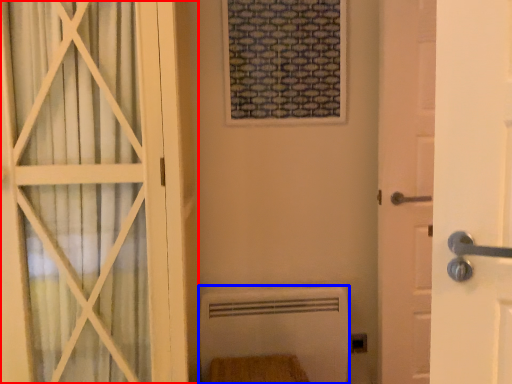
Question: Among these objects, which one is farthest to the camera, door (highlighted by a red box) or radiator (highlighted by a blue box)?

Choices:
 (A) door
 (B) radiator

Answer: (B)